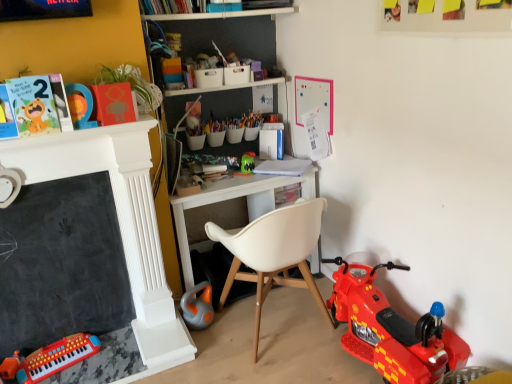
Identify the location of vacant region under orange plastic toy at lower center, which ranks as the fourth toy in left-to-right order (from a real-world perspective). (205, 324).